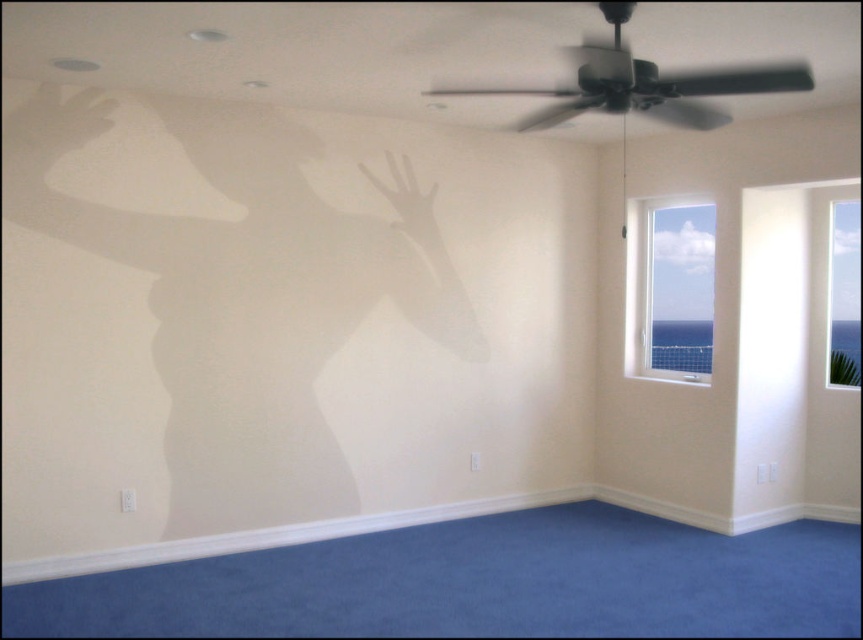
You are a guest in this room and want to open the transparent glass window at right to let some fresh air in. However, there is a transparent plastic hand at upper left blocking your path. Can you move around it to reach the window?

The transparent plastic hand at upper left is to the left of transparent glass window at right, so you can move around to the right side of the transparent plastic hand at upper left to reach the transparent glass window at right.

You are an interior designer planning to install a new light fixture. You need to decide whether the transparent glass window at upper right is to the right or left of the matte white hand at upper left. Which side is it on?

The transparent glass window at upper right is positioned on the right side of matte white hand at upper left, so it is to the right of the matte white hand at upper left.

You are standing in the room and notice the transparent glass window at upper right and the matte white hand at upper left. Which object is taller?

The transparent glass window at upper right is taller than the matte white hand at upper left according to the description.